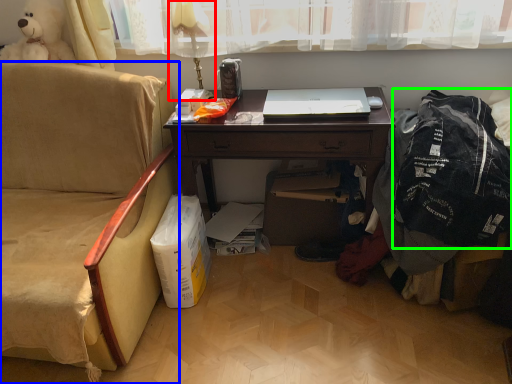
Question: Considering the real-world distances, which object is farthest from table lamp (highlighted by a red box)? chair (highlighted by a blue box) or clothing (highlighted by a green box)?

Choices:
 (A) chair
 (B) clothing

Answer: (B)